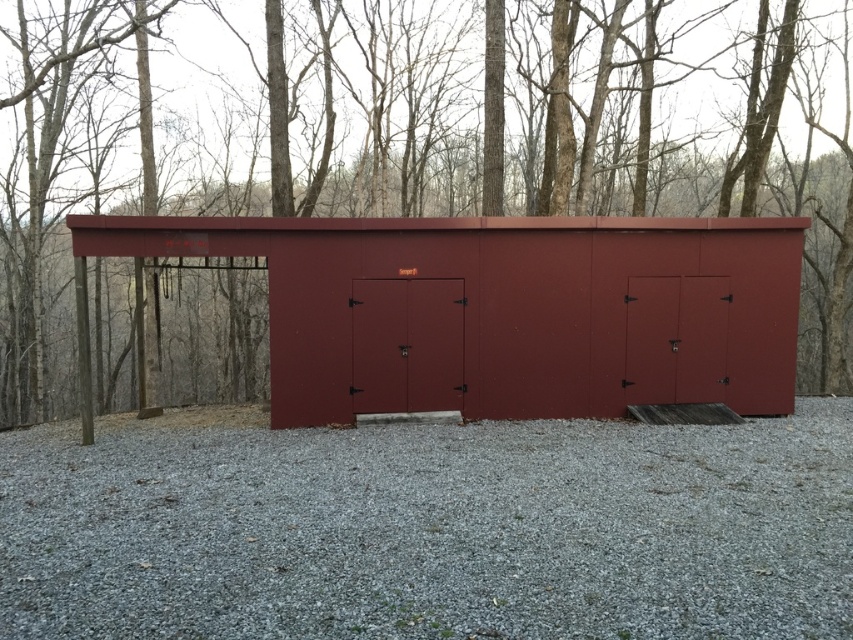
Question: Does gray gravel at center have a lesser width compared to matte red shed at center?

Choices:
 (A) no
 (B) yes

Answer: (A)

Question: Based on their relative distances, which object is farther from the smooth bark tree at center?

Choices:
 (A) gray gravel at center
 (B) matte red shed at center

Answer: (B)

Question: From the image, what is the correct spatial relationship of gray gravel at center in relation to matte red shed at center?

Choices:
 (A) right
 (B) left

Answer: (A)

Question: Which point is closer to the camera?

Choices:
 (A) (256, 225)
 (B) (235, 440)
 (C) (718, 221)

Answer: (B)

Question: Is gray gravel at center to the right of matte red shed at center from the viewer's perspective?

Choices:
 (A) yes
 (B) no

Answer: (A)

Question: Which object is farther from the camera taking this photo?

Choices:
 (A) matte red shed at center
 (B) smooth bark tree at center

Answer: (A)